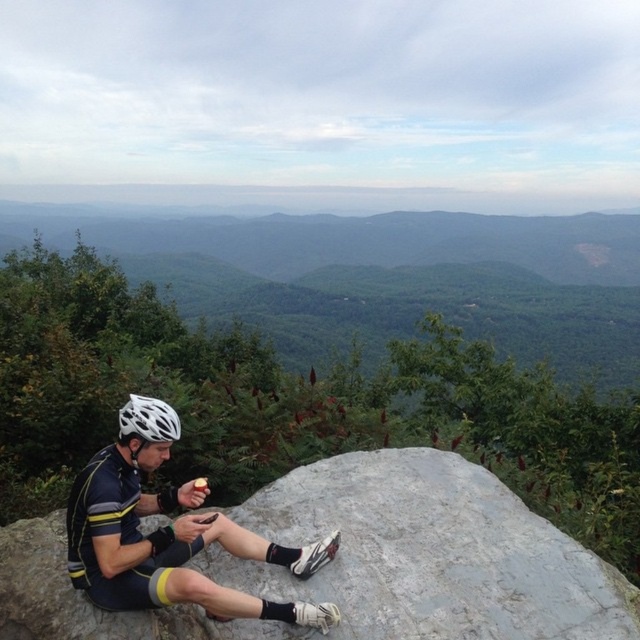
Can you confirm if gray textured rock at center is wider than matte black helmet at center?

Yes, gray textured rock at center is wider than matte black helmet at center.

Where is `gray textured rock at center`? The height and width of the screenshot is (640, 640). gray textured rock at center is located at coordinates (358, 563).

At what (x,y) coordinates should I click in order to perform the action: click on gray textured rock at center. Please return your answer as a coordinate pair (x, y). This screenshot has width=640, height=640. Looking at the image, I should click on (358, 563).

Is matte black helmet at center shorter than white matte bicycle helmet at left?

Incorrect, matte black helmet at center's height does not fall short of white matte bicycle helmet at left's.

Which is below, matte black helmet at center or white matte bicycle helmet at left?

Positioned lower is matte black helmet at center.

Is point (93, 476) behind point (120, 413)?

No, (93, 476) is closer to viewer.

Locate an element on the screen. Image resolution: width=640 pixels, height=640 pixels. matte black helmet at center is located at coordinates (168, 532).

Which is above, gray textured rock at center or green leafy mountain at center?

green leafy mountain at center is higher up.

Between gray textured rock at center and green leafy mountain at center, which one is positioned lower?

gray textured rock at center

Where is `gray textured rock at center`? gray textured rock at center is located at coordinates (358, 563).

The width and height of the screenshot is (640, 640). I want to click on gray textured rock at center, so click(x=358, y=563).